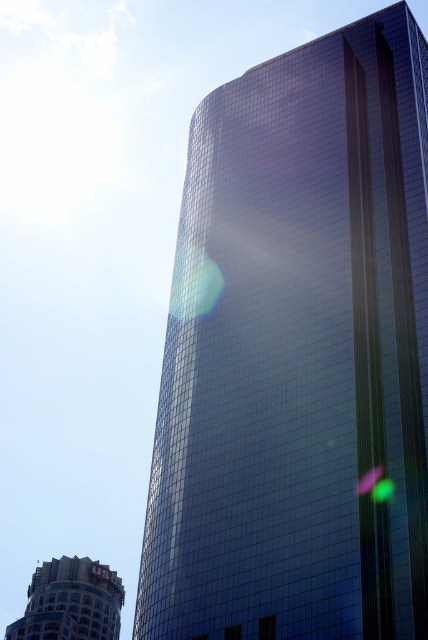
Question: Does glossy glass tower at center appear on the right side of matte silver building at lower left?

Choices:
 (A) no
 (B) yes

Answer: (B)

Question: Is glossy glass tower at center bigger than matte silver building at lower left?

Choices:
 (A) no
 (B) yes

Answer: (B)

Question: Does glossy glass tower at center have a smaller size compared to matte silver building at lower left?

Choices:
 (A) yes
 (B) no

Answer: (B)

Question: Which point is closer to the camera?

Choices:
 (A) glossy glass tower at center
 (B) matte silver building at lower left

Answer: (A)